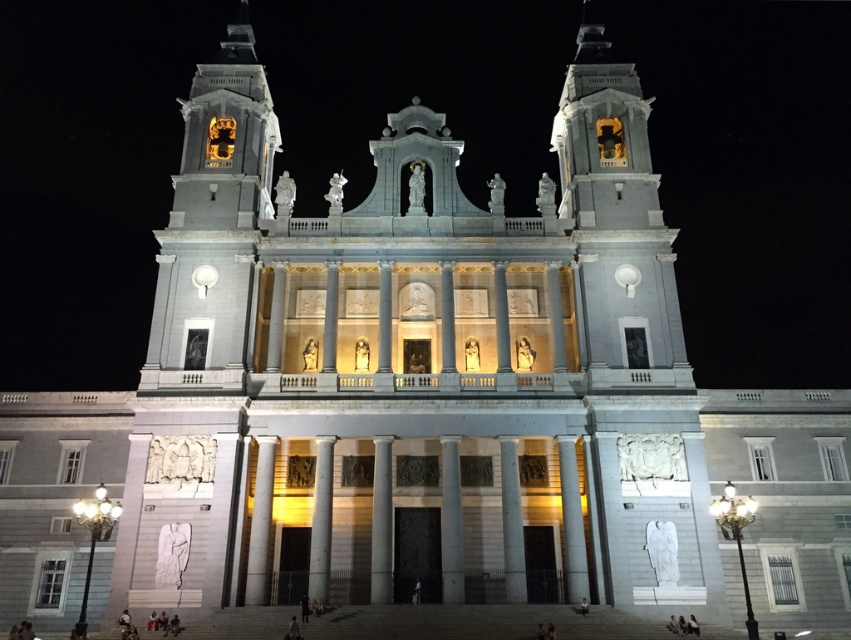
Does smooth stone tower at center-left have a lesser height compared to white marble column at center?

Incorrect, smooth stone tower at center-left's height does not fall short of white marble column at center's.

Image resolution: width=851 pixels, height=640 pixels. Find the location of `smooth stone tower at center-left`. smooth stone tower at center-left is located at coordinates (214, 220).